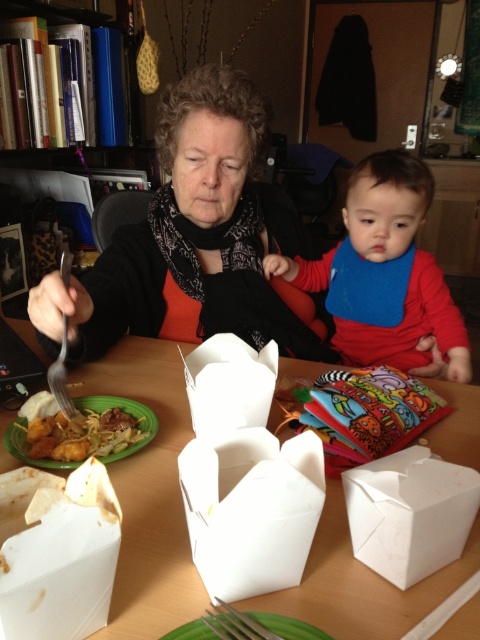
Question: Does wooden table at center have a greater width compared to silver metallic fork at upper left?

Choices:
 (A) yes
 (B) no

Answer: (A)

Question: Is matte black sweater at upper center below wooden table at center?

Choices:
 (A) no
 (B) yes

Answer: (A)

Question: Which of the following is the closest to the observer?

Choices:
 (A) (240, 92)
 (B) (160, 394)

Answer: (B)

Question: Does wooden table at center have a larger size compared to blue fabric bib at right?

Choices:
 (A) no
 (B) yes

Answer: (B)

Question: Among these points, which one is nearest to the camera?

Choices:
 (A) click(48, 422)
 (B) click(72, 410)
 (C) click(73, 349)

Answer: (A)

Question: Which point is farther to the camera?

Choices:
 (A) (180, 618)
 (B) (399, 250)

Answer: (B)